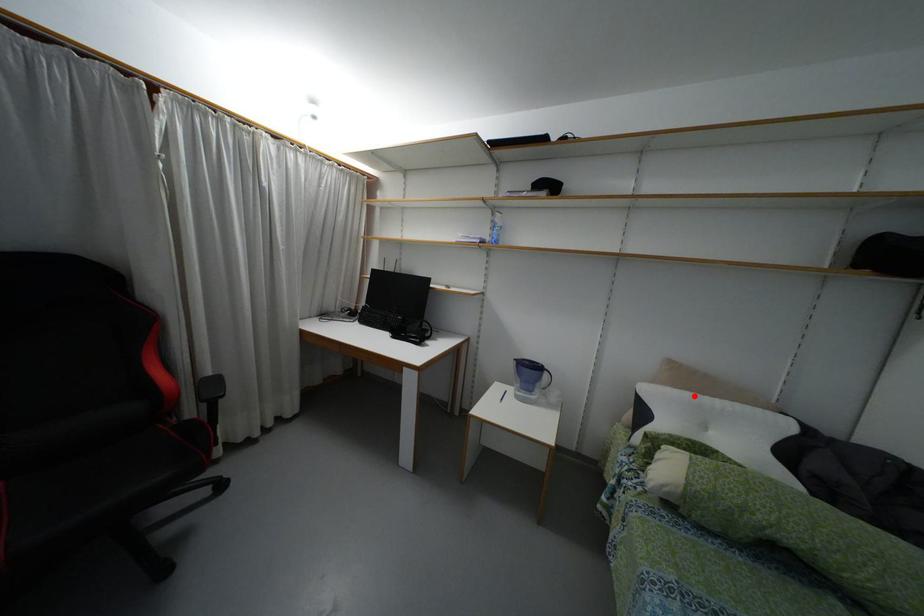
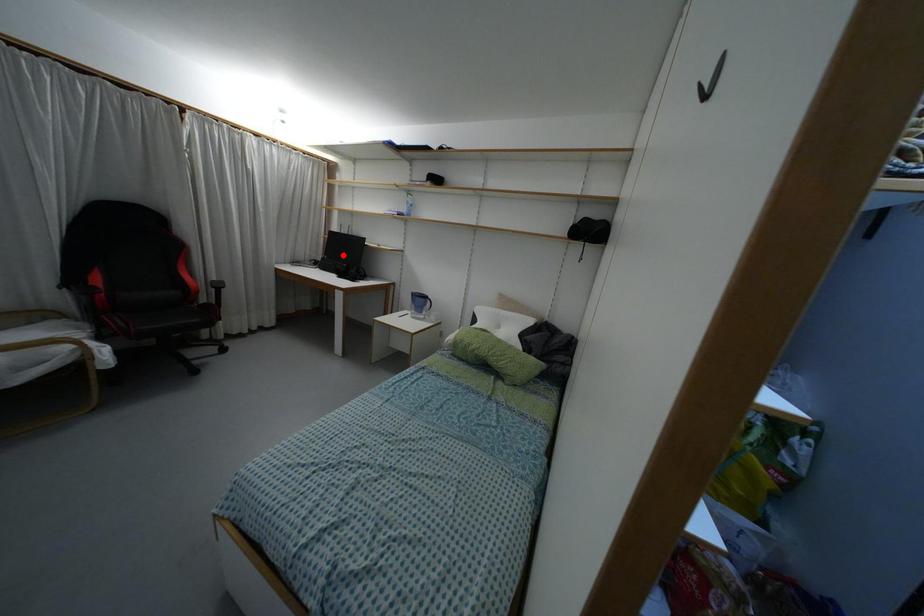
I am providing you with two images of the same scene from different viewpoints. A red point is marked on the first image and another point is marked on the second image. Is the marked point in image1 the same physical position as the marked point in image2?

No